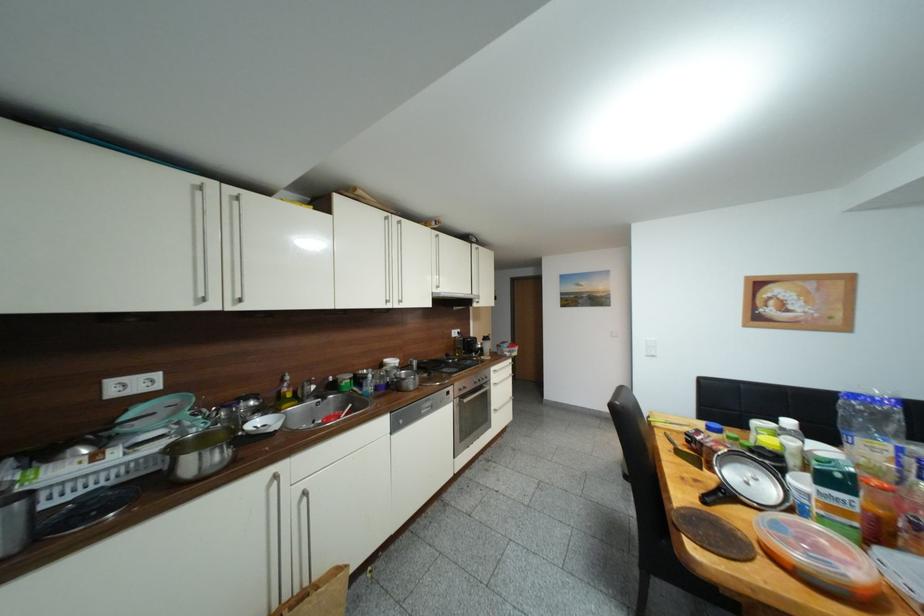
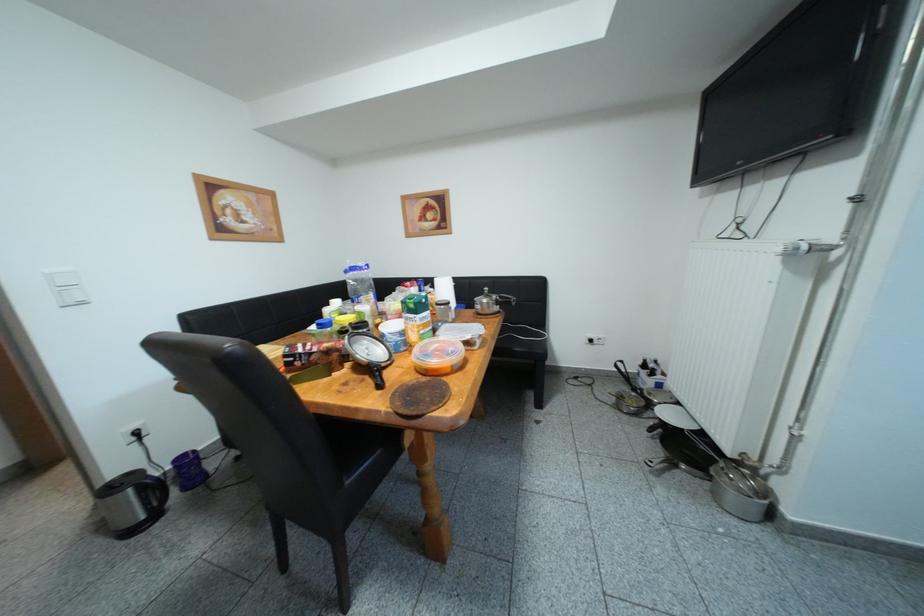
Question: The camera is either moving clockwise (left) or counter-clockwise (right) around the object. The first image is from the beginning of the video and the second image is from the end. Is the camera moving left or right when shooting the video?

Choices:
 (A) Left
 (B) Right

Answer: (A)